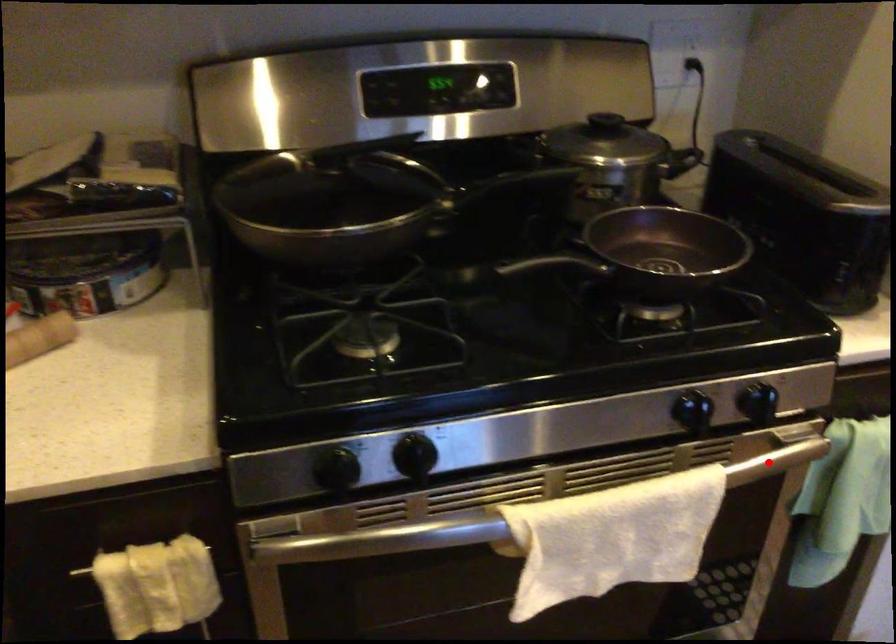
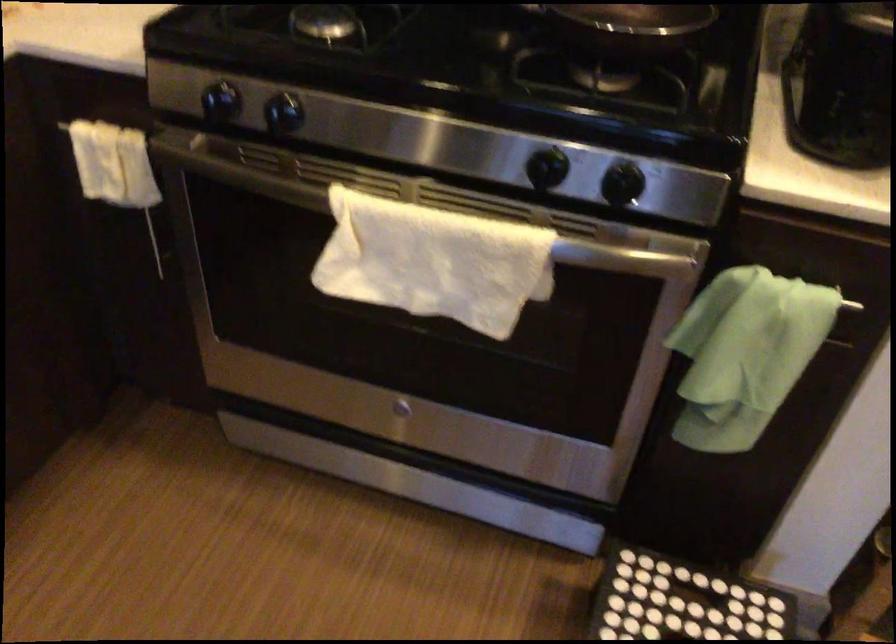
Find the pixel in the second image that matches the highlighted location in the first image.

(618, 257)